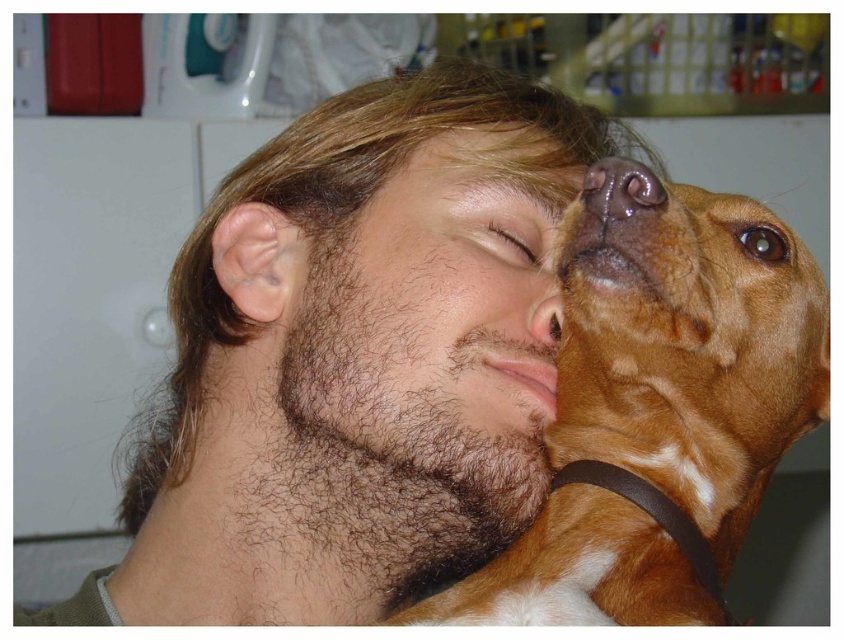
Based on the photo, which is more to the right, brown leather dog at center or brown glossy eye at upper right?

brown glossy eye at upper right is more to the right.

Which is behind, point (747, 355) or point (745, 228)?

The point (745, 228) is behind.

The width and height of the screenshot is (844, 640). What are the coordinates of `brown leather dog at center` in the screenshot? It's located at (686, 353).

Which is above, brown hairy face at center or brown matte dog nose at upper center?

brown hairy face at center is above.

Can you confirm if brown hairy face at center is positioned to the right of brown matte dog nose at upper center?

Incorrect, brown hairy face at center is not on the right side of brown matte dog nose at upper center.

Where is `brown hairy face at center`? brown hairy face at center is located at coordinates (423, 342).

Locate an element on the screen. brown hairy face at center is located at coordinates (423, 342).

Can you confirm if brown leather dog at center is bigger than brown hairy face at center?

Yes, brown leather dog at center is bigger than brown hairy face at center.

Looking at this image, can you confirm if brown leather dog at center is thinner than brown hairy face at center?

In fact, brown leather dog at center might be wider than brown hairy face at center.

Does point (466, 582) lie behind point (333, 509)?

No, it is in front of (333, 509).

Locate an element on the screen. This screenshot has height=640, width=844. brown leather dog at center is located at coordinates (686, 353).